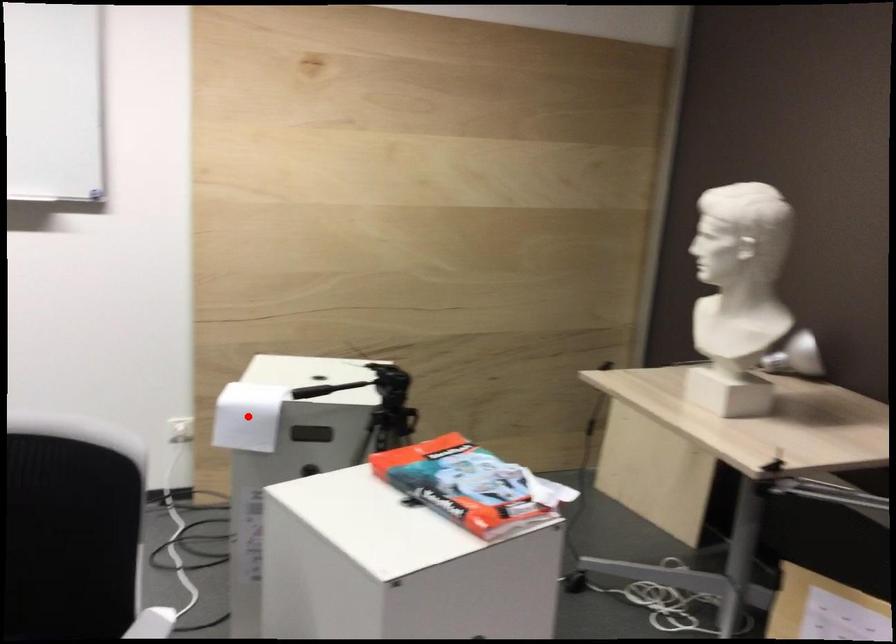
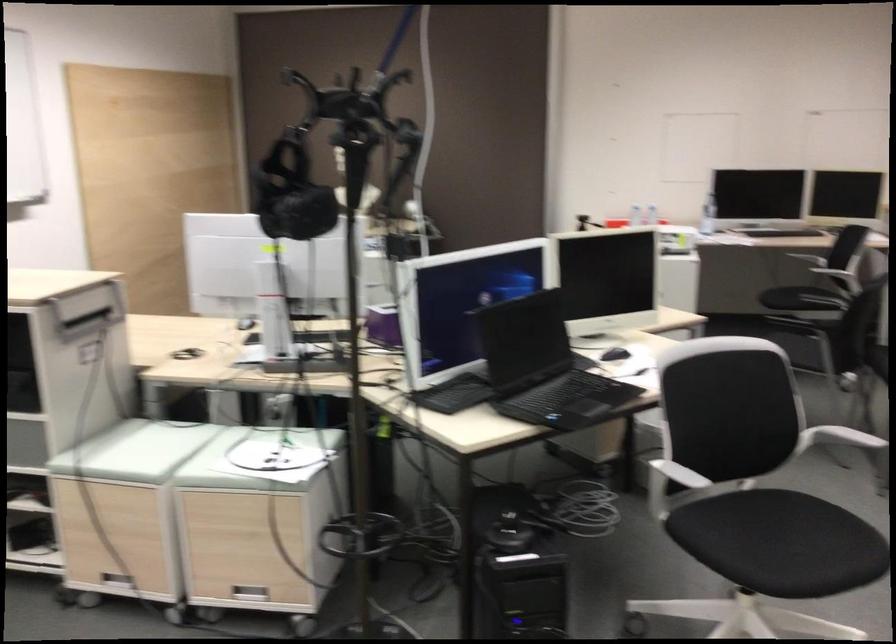
Question: I am providing you with two images of the same scene from different viewpoints. A red point is marked on the first image. At the location where the point appears in image 1, is it still visible in image 2?

Choices:
 (A) Yes
 (B) No

Answer: (B)